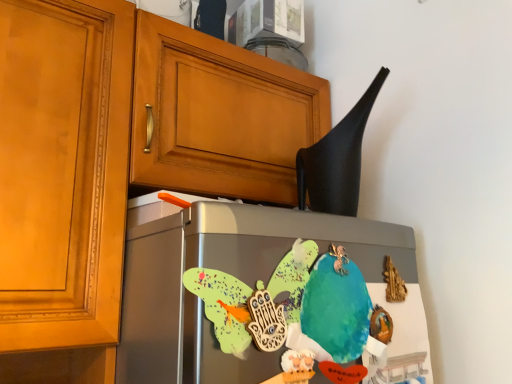
Question: From a real-world perspective, does watercolor paper parrot at center stand above black matte exhaust hood at upper right?

Choices:
 (A) yes
 (B) no

Answer: (B)

Question: Can you see watercolor paper parrot at center touching black matte exhaust hood at upper right?

Choices:
 (A) no
 (B) yes

Answer: (A)

Question: From a real-world perspective, is watercolor paper parrot at center positioned under black matte exhaust hood at upper right based on gravity?

Choices:
 (A) yes
 (B) no

Answer: (A)

Question: Does watercolor paper parrot at center lie in front of black matte exhaust hood at upper right?

Choices:
 (A) yes
 (B) no

Answer: (A)

Question: Can you confirm if watercolor paper parrot at center is thinner than black matte exhaust hood at upper right?

Choices:
 (A) yes
 (B) no

Answer: (A)

Question: Does point (346, 317) appear closer or farther from the camera than point (236, 352)?

Choices:
 (A) closer
 (B) farther

Answer: (B)

Question: Looking at their shapes, would you say watercolor paper parrot at center is wider or thinner than satin silver fridge at center?

Choices:
 (A) thin
 (B) wide

Answer: (A)

Question: Is watercolor paper parrot at center to the left or to the right of satin silver fridge at center in the image?

Choices:
 (A) right
 (B) left

Answer: (A)

Question: In terms of size, does watercolor paper parrot at center appear bigger or smaller than satin silver fridge at center?

Choices:
 (A) small
 (B) big

Answer: (A)

Question: In terms of width, does satin silver fridge at center look wider or thinner when compared to watercolor paper parrot at center?

Choices:
 (A) wide
 (B) thin

Answer: (A)

Question: Considering the positions of satin silver fridge at center and watercolor paper parrot at center in the image, is satin silver fridge at center bigger or smaller than watercolor paper parrot at center?

Choices:
 (A) big
 (B) small

Answer: (A)

Question: Is satin silver fridge at center taller or shorter than watercolor paper parrot at center?

Choices:
 (A) short
 (B) tall

Answer: (B)

Question: Would you say satin silver fridge at center is to the left or to the right of watercolor paper parrot at center in the picture?

Choices:
 (A) left
 (B) right

Answer: (A)

Question: In terms of height, does matte wood cabinet at upper left look taller or shorter compared to watercolor paper parrot at center?

Choices:
 (A) short
 (B) tall

Answer: (B)

Question: Considering the positions of matte wood cabinet at upper left and watercolor paper parrot at center in the image, is matte wood cabinet at upper left wider or thinner than watercolor paper parrot at center?

Choices:
 (A) wide
 (B) thin

Answer: (A)